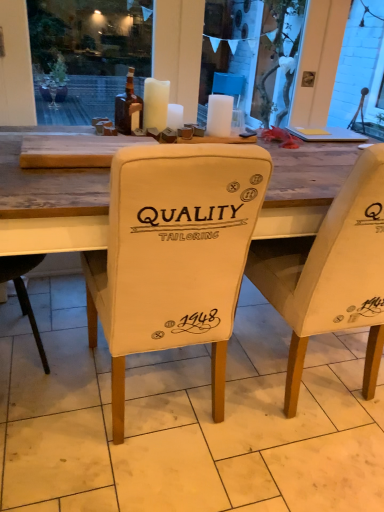
You are a GUI agent. You are given a task and a screenshot of the screen. Output one action in this format:
    pyautogui.click(x=<x>, y=<y>)
    Task: Click on the vacant area situated below beige fabric chair at center, the 1th chair positioned from the left (from a real-world perspective)
    The image size is (384, 512).
    Given the screenshot: What is the action you would take?
    pyautogui.click(x=153, y=399)